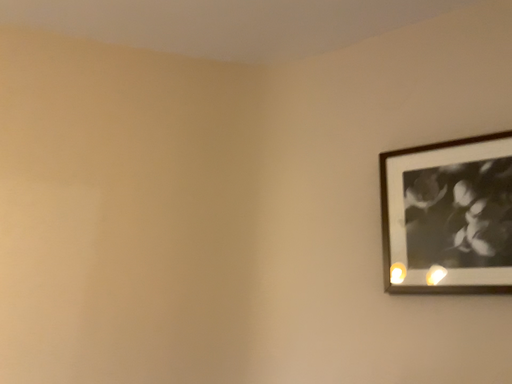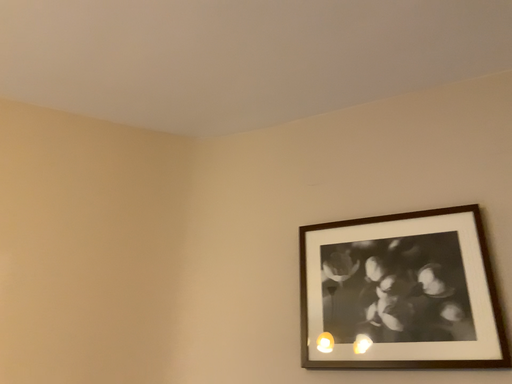
Question: How did the camera likely rotate when shooting the video?

Choices:
 (A) rotated downward
 (B) rotated upward

Answer: (B)